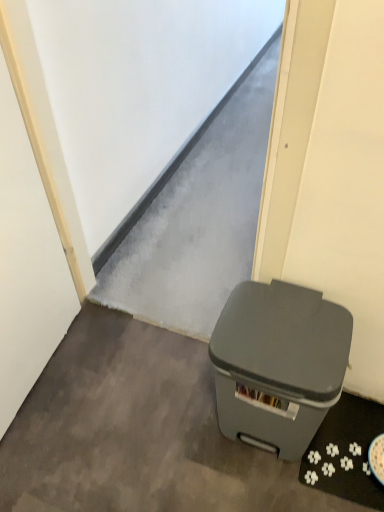
The width and height of the screenshot is (384, 512). Find the location of `gray matte trash can at lower right`. gray matte trash can at lower right is located at coordinates (137, 432).

What do you see at coordinates (137, 432) in the screenshot?
I see `gray matte trash can at lower right` at bounding box center [137, 432].

Where is `matte gray plastic trash can at lower right`? The image size is (384, 512). matte gray plastic trash can at lower right is located at coordinates (279, 362).

The height and width of the screenshot is (512, 384). Describe the element at coordinates (279, 362) in the screenshot. I see `matte gray plastic trash can at lower right` at that location.

Where is `gray matte trash can at lower right`? The width and height of the screenshot is (384, 512). gray matte trash can at lower right is located at coordinates (137, 432).

Which is more to the left, matte gray plastic trash can at lower right or gray matte trash can at lower right?

gray matte trash can at lower right.

Is matte gray plastic trash can at lower right positioned before gray matte trash can at lower right?

Yes.

Does point (213, 334) appear closer or farther from the camera than point (156, 387)?

Clearly, point (213, 334) is closer to the camera than point (156, 387).

From the image's perspective, is matte gray plastic trash can at lower right positioned above or below gray matte trash can at lower right?

matte gray plastic trash can at lower right is above gray matte trash can at lower right.

From a real-world perspective, who is located higher, matte gray plastic trash can at lower right or gray matte trash can at lower right?

matte gray plastic trash can at lower right.

Is matte gray plastic trash can at lower right thinner than gray matte trash can at lower right?

Indeed, matte gray plastic trash can at lower right has a lesser width compared to gray matte trash can at lower right.

Who is shorter, matte gray plastic trash can at lower right or gray matte trash can at lower right?

gray matte trash can at lower right.

Based on the photo, which of these two, matte gray plastic trash can at lower right or gray matte trash can at lower right, is smaller?

With smaller size is gray matte trash can at lower right.

Is gray matte trash can at lower right surrounded by matte gray plastic trash can at lower right?

Definitely not — gray matte trash can at lower right is not inside matte gray plastic trash can at lower right.

Is matte gray plastic trash can at lower right far from gray matte trash can at lower right?

matte gray plastic trash can at lower right is near gray matte trash can at lower right, not far away.

Is gray matte trash can at lower right at the back of matte gray plastic trash can at lower right?

No.

How many degrees apart are the facing directions of matte gray plastic trash can at lower right and gray matte trash can at lower right?

179 degrees separate the facing orientations of matte gray plastic trash can at lower right and gray matte trash can at lower right.

The image size is (384, 512). What are the coordinates of `waste container located on the right of gray matte trash can at lower right` in the screenshot? It's located at (279, 362).

Which is more to the left, gray matte trash can at lower right or matte gray plastic trash can at lower right?

From the viewer's perspective, gray matte trash can at lower right appears more on the left side.

Does gray matte trash can at lower right lie behind matte gray plastic trash can at lower right?

Yes, the depth of gray matte trash can at lower right is greater than that of matte gray plastic trash can at lower right.

Is point (147, 383) positioned before point (301, 446)?

No, it is not.

From the image's perspective, between gray matte trash can at lower right and matte gray plastic trash can at lower right, which one is located above?

From the image's view, matte gray plastic trash can at lower right is above.

From a real-world perspective, is gray matte trash can at lower right located higher than matte gray plastic trash can at lower right?

No, from a real-world perspective, gray matte trash can at lower right is not above matte gray plastic trash can at lower right.

Can you confirm if gray matte trash can at lower right is thinner than matte gray plastic trash can at lower right?

No, gray matte trash can at lower right is not thinner than matte gray plastic trash can at lower right.

Considering the sizes of gray matte trash can at lower right and matte gray plastic trash can at lower right in the image, is gray matte trash can at lower right taller or shorter than matte gray plastic trash can at lower right?

In the image, gray matte trash can at lower right appears to be shorter than matte gray plastic trash can at lower right.

Can you confirm if gray matte trash can at lower right is smaller than matte gray plastic trash can at lower right?

Correct, gray matte trash can at lower right occupies less space than matte gray plastic trash can at lower right.

Can matte gray plastic trash can at lower right be found inside gray matte trash can at lower right?

No, matte gray plastic trash can at lower right is not inside gray matte trash can at lower right.

Is gray matte trash can at lower right placed right next to matte gray plastic trash can at lower right?

gray matte trash can at lower right is not next to matte gray plastic trash can at lower right, and they're not touching.

Is gray matte trash can at lower right oriented away from matte gray plastic trash can at lower right?

No, matte gray plastic trash can at lower right is not at the back of gray matte trash can at lower right.

Can you tell me how much gray matte trash can at lower right and matte gray plastic trash can at lower right differ in facing direction?

The facing directions of gray matte trash can at lower right and matte gray plastic trash can at lower right are 179 degrees apart.

How distant is gray matte trash can at lower right from matte gray plastic trash can at lower right?

gray matte trash can at lower right is 13.15 inches away from matte gray plastic trash can at lower right.

The image size is (384, 512). Find the location of `waste container above the gray matte trash can at lower right (from a real-world perspective)`. waste container above the gray matte trash can at lower right (from a real-world perspective) is located at coordinates (279, 362).

The height and width of the screenshot is (512, 384). There is a gray matte trash can at lower right. Find the location of `waste container above it (from a real-world perspective)`. waste container above it (from a real-world perspective) is located at coordinates (279, 362).

Image resolution: width=384 pixels, height=512 pixels. Identify the location of waste container lying above the gray matte trash can at lower right (from the image's perspective). tap(279, 362).